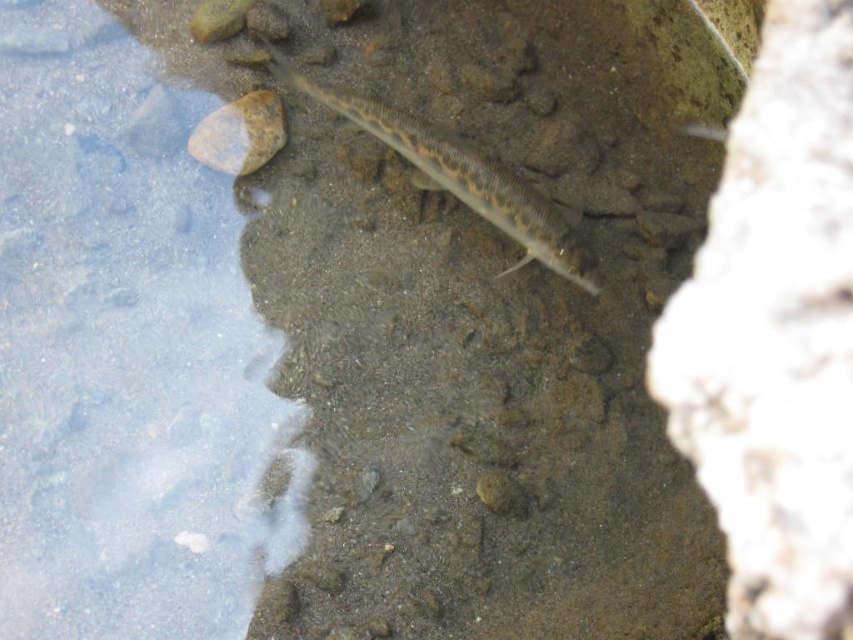
Question: Does clear water at left have a lesser width compared to sandy brown fish at center?

Choices:
 (A) yes
 (B) no

Answer: (A)

Question: Which point is closer to the camera taking this photo?

Choices:
 (A) (231, 128)
 (B) (590, 291)

Answer: (B)

Question: Which point is farther from the camera taking this photo?

Choices:
 (A) (254, 131)
 (B) (398, 109)

Answer: (A)

Question: Among these points, which one is farthest from the camera?

Choices:
 (A) (392, 140)
 (B) (279, 106)

Answer: (B)

Question: Is clear water at left to the left of brown rough rock at upper left from the viewer's perspective?

Choices:
 (A) no
 (B) yes

Answer: (B)

Question: Is clear water at left above brown rough rock at upper left?

Choices:
 (A) no
 (B) yes

Answer: (A)